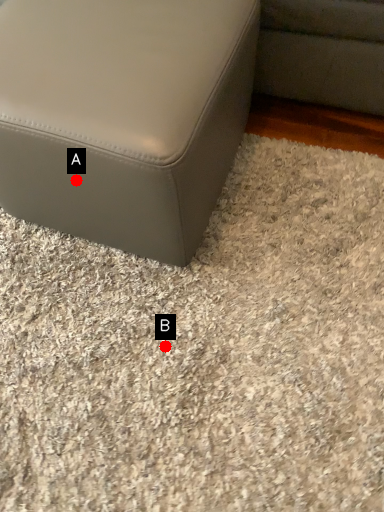
Question: Two points are circled on the image, labeled by A and B beside each circle. Among these points, which one is farthest from the camera?

Choices:
 (A) A is further
 (B) B is further

Answer: (B)